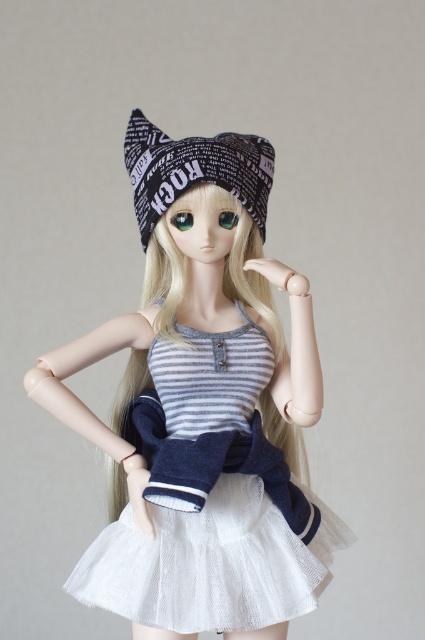
Question: Can you confirm if white tulle skirt at center is positioned above black printed beanie at center?

Choices:
 (A) no
 (B) yes

Answer: (A)

Question: Can you confirm if white tulle skirt at center is thinner than black printed beanie at center?

Choices:
 (A) no
 (B) yes

Answer: (A)

Question: Can you confirm if white tulle skirt at center is positioned above black printed beanie at center?

Choices:
 (A) yes
 (B) no

Answer: (B)

Question: Which point is farther to the camera?

Choices:
 (A) (243, 150)
 (B) (201, 156)

Answer: (A)